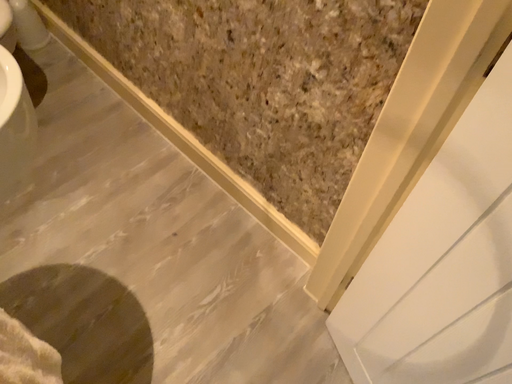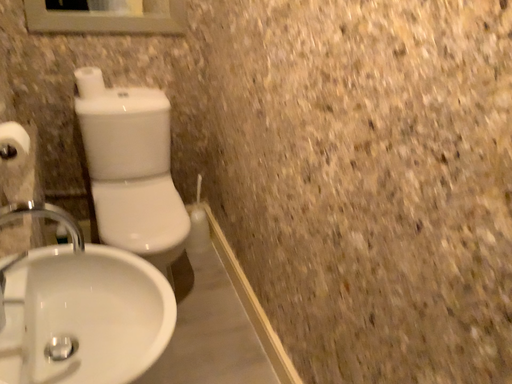
Question: How did the camera likely rotate when shooting the video?

Choices:
 (A) rotated downward
 (B) rotated upward

Answer: (B)